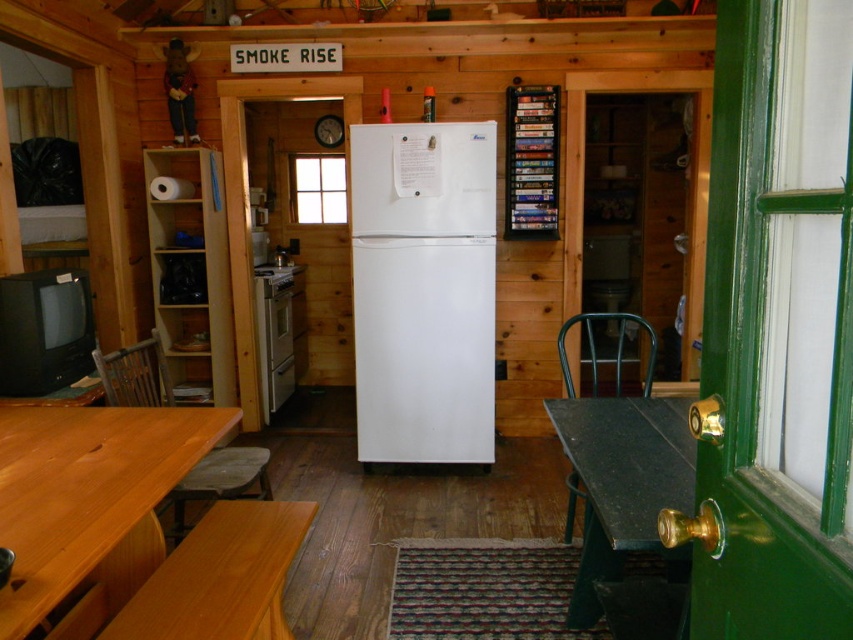
Question: Which is farther from the natural wood table at lower left?

Choices:
 (A) green marble table at right
 (B) wooden chair at lower left

Answer: (A)

Question: Estimate the real-world distances between objects in this image. Which object is farther from the green metal chair at right?

Choices:
 (A) white matte refrigerator at center
 (B) natural wood table at lower left

Answer: (B)

Question: Does white glossy oven at center have a larger size compared to green metal chair at right?

Choices:
 (A) no
 (B) yes

Answer: (A)

Question: Which object is positioned closest to the white glossy oven at center?

Choices:
 (A) green metal chair at right
 (B) white matte refrigerator at center
 (C) green marble table at right

Answer: (B)

Question: Does white glossy oven at center appear under green metal chair at right?

Choices:
 (A) yes
 (B) no

Answer: (A)

Question: Does natural wood table at lower left have a lesser width compared to light brown wood table at lower left?

Choices:
 (A) no
 (B) yes

Answer: (A)